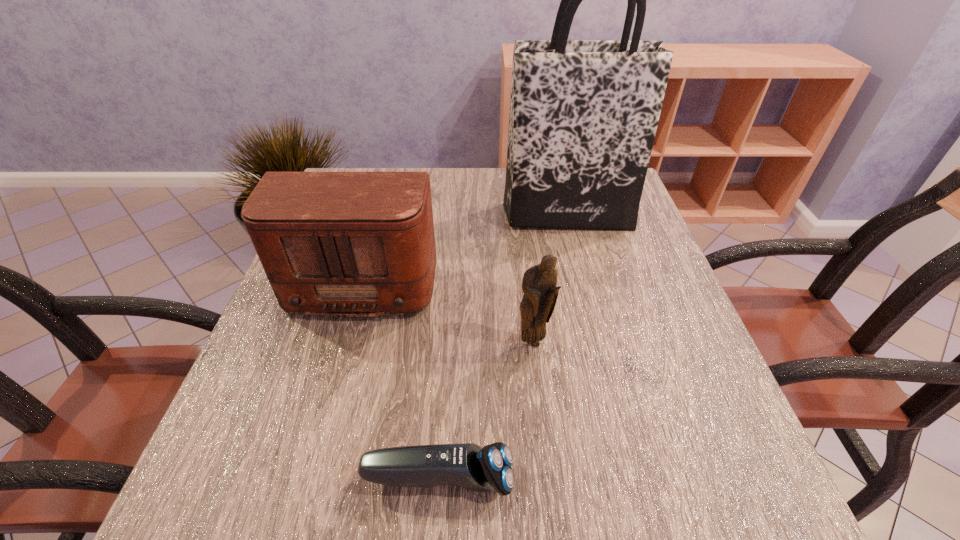
This screenshot has height=540, width=960. I want to click on object located at the far edge, so click(583, 116).

Find the location of a particular element. This screenshot has height=540, width=960. object positioned at the near edge is located at coordinates (467, 465).

The height and width of the screenshot is (540, 960). What are the coordinates of `object that is at the left edge` in the screenshot? It's located at pos(348,244).

At what (x,y) coordinates should I click in order to perform the action: click on object that is at the right edge. Please return your answer as a coordinate pair (x, y). The width and height of the screenshot is (960, 540). Looking at the image, I should click on (583, 116).

The image size is (960, 540). Identify the location of object that is at the far right corner. (583, 116).

Where is `vacant space at the far edge of the desktop`? vacant space at the far edge of the desktop is located at coordinates (485, 172).

Where is `vacant region at the near edge of the desktop`? The image size is (960, 540). vacant region at the near edge of the desktop is located at coordinates (579, 509).

The image size is (960, 540). Identify the location of blank space at the left edge. (332, 320).

This screenshot has width=960, height=540. I want to click on free space at the right edge of the desktop, so click(x=673, y=369).

Identify the location of free space at the near left corner of the desktop. (230, 504).